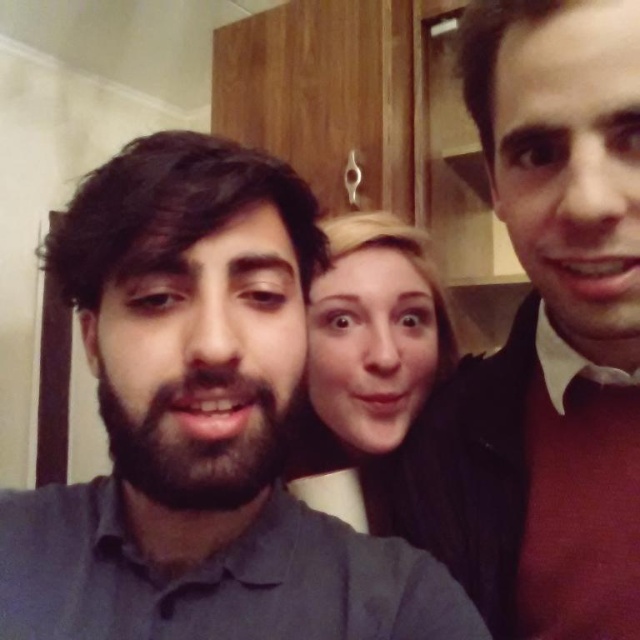
Question: Can you confirm if burgundy sweater at right is smaller than smooth blonde hair at center?

Choices:
 (A) yes
 (B) no

Answer: (B)

Question: Which is farther from the smooth blonde hair at center?

Choices:
 (A) dark gray shirt at left
 (B) burgundy sweater at right

Answer: (A)

Question: Which object appears farthest from the camera in this image?

Choices:
 (A) dark gray shirt at left
 (B) burgundy sweater at right
 (C) smooth blonde hair at center

Answer: (C)

Question: Is burgundy sweater at right to the right of smooth blonde hair at center from the viewer's perspective?

Choices:
 (A) no
 (B) yes

Answer: (B)

Question: Can you confirm if burgundy sweater at right is bigger than smooth blonde hair at center?

Choices:
 (A) no
 (B) yes

Answer: (B)

Question: Which point is closer to the camera?

Choices:
 (A) burgundy sweater at right
 (B) smooth blonde hair at center
 (C) dark gray shirt at left

Answer: (C)